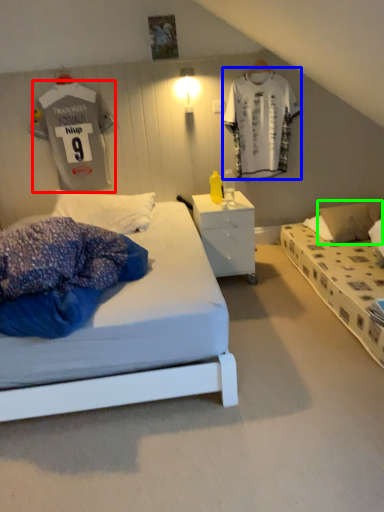
Question: Estimate the real-world distances between objects in this image. Which object is farther from t shirt (highlighted by a red box), t shirt (highlighted by a blue box) or pillow (highlighted by a green box)?

Choices:
 (A) t shirt
 (B) pillow

Answer: (B)